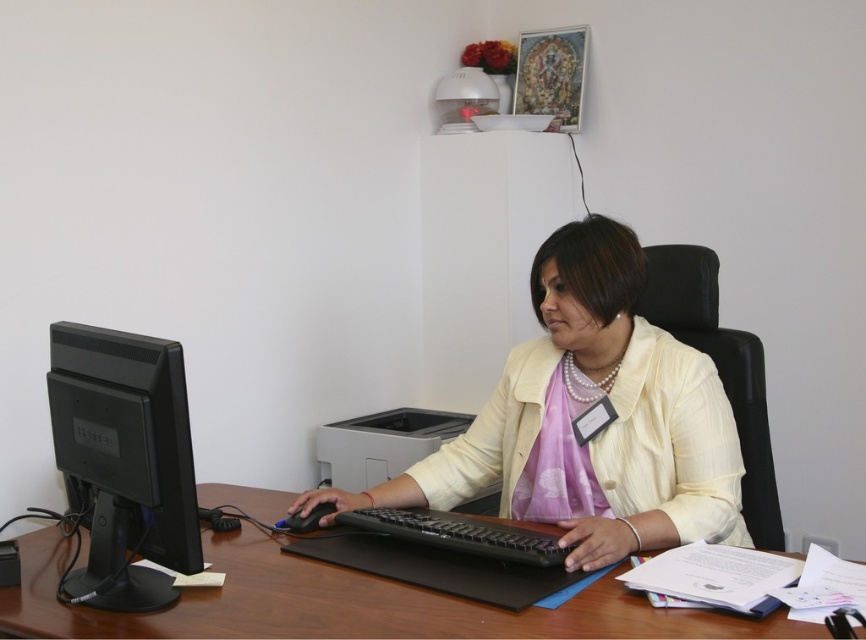
Does black plastic keyboard at center appear under black matte mouse at center?

No.

You are a GUI agent. You are given a task and a screenshot of the screen. Output one action in this format:
    pyautogui.click(x=<x>, y=<y>)
    Task: Click on the black plastic keyboard at center
    
    Given the screenshot: What is the action you would take?
    pyautogui.click(x=459, y=532)

This screenshot has width=866, height=640. Describe the element at coordinates (125, 460) in the screenshot. I see `black glossy monitor at left` at that location.

Is black glossy monitor at left shorter than black plastic keyboard at center?

No.

Does point (75, 468) come in front of point (438, 536)?

That is True.

Identify the location of black glossy monitor at left. The width and height of the screenshot is (866, 640). (125, 460).

Is black glossy monitor at left positioned at the back of black matte mouse at center?

That is False.

Is point (173, 529) positioned in front of point (291, 522)?

Yes, point (173, 529) is closer to viewer.

Which is behind, point (128, 600) or point (281, 524)?

Point (281, 524)

Find the location of a particular element. The image size is (866, 640). black glossy monitor at left is located at coordinates (125, 460).